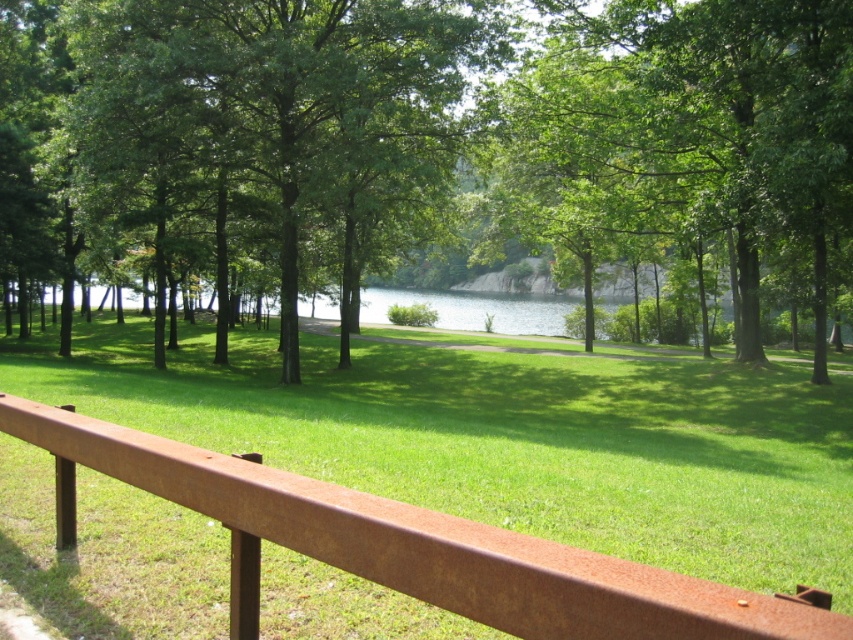
You are standing at the point closer to the camera between the two points, point (244,172) and point (343,500). Which point are you standing at?

You are standing at point (244,172) because it is further to the camera than point (343,500).

You are standing on a bridge and see the green leafy tree at center and the rusty metal rail at center. Which object is positioned to the left when facing the scene?

The green leafy tree at center is to the left of the rusty metal rail at center.

You are standing at the edge of a bridge and see the green leafy tree at center and the rusty metal rail at center. Which object would block your view of the water if you move closer to the center of the bridge?

The green leafy tree at center is bigger than the rusty metal rail at center, so it would block your view of the water if you move closer to the center of the bridge.